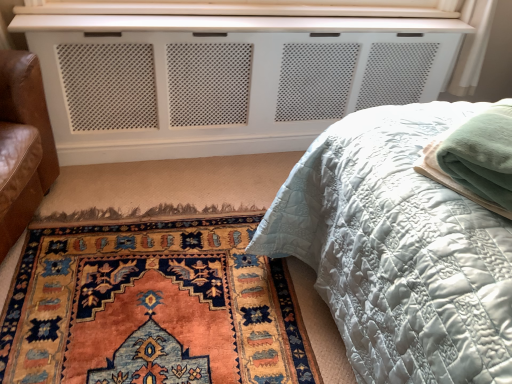
Question: From the image's perspective, is matte white quilted bed at center over carpet with intricate patterns at lower left?

Choices:
 (A) no
 (B) yes

Answer: (B)

Question: Is matte white quilted bed at center further to the viewer compared to carpet with intricate patterns at lower left?

Choices:
 (A) no
 (B) yes

Answer: (A)

Question: Is matte white quilted bed at center positioned in front of carpet with intricate patterns at lower left?

Choices:
 (A) yes
 (B) no

Answer: (A)

Question: Does matte white quilted bed at center have a greater height compared to carpet with intricate patterns at lower left?

Choices:
 (A) no
 (B) yes

Answer: (B)

Question: Can you confirm if matte white quilted bed at center is shorter than carpet with intricate patterns at lower left?

Choices:
 (A) yes
 (B) no

Answer: (B)

Question: Are matte white quilted bed at center and carpet with intricate patterns at lower left beside each other?

Choices:
 (A) no
 (B) yes

Answer: (A)

Question: From the image's perspective, is carpet with intricate patterns at lower left on top of green fleece blanket at right?

Choices:
 (A) no
 (B) yes

Answer: (A)

Question: Considering the relative sizes of carpet with intricate patterns at lower left and green fleece blanket at right in the image provided, is carpet with intricate patterns at lower left smaller than green fleece blanket at right?

Choices:
 (A) no
 (B) yes

Answer: (A)

Question: Is carpet with intricate patterns at lower left wider than green fleece blanket at right?

Choices:
 (A) yes
 (B) no

Answer: (A)

Question: From a real-world perspective, is carpet with intricate patterns at lower left on top of green fleece blanket at right?

Choices:
 (A) yes
 (B) no

Answer: (B)

Question: Is carpet with intricate patterns at lower left at the left side of green fleece blanket at right?

Choices:
 (A) no
 (B) yes

Answer: (B)

Question: Is green fleece blanket at right inside carpet with intricate patterns at lower left?

Choices:
 (A) no
 (B) yes

Answer: (A)

Question: Is green fleece blanket at right facing towards white perforated panel at upper center?

Choices:
 (A) no
 (B) yes

Answer: (A)